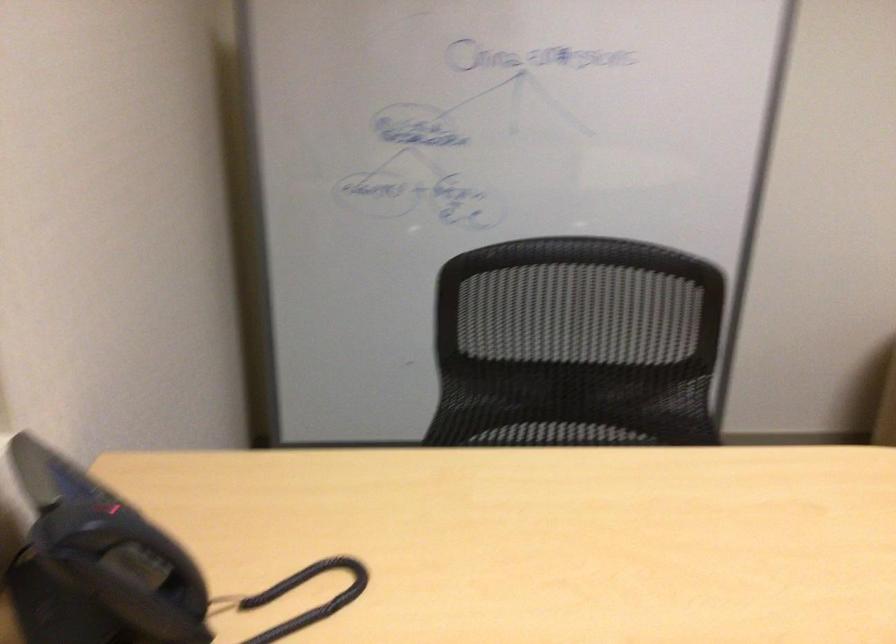
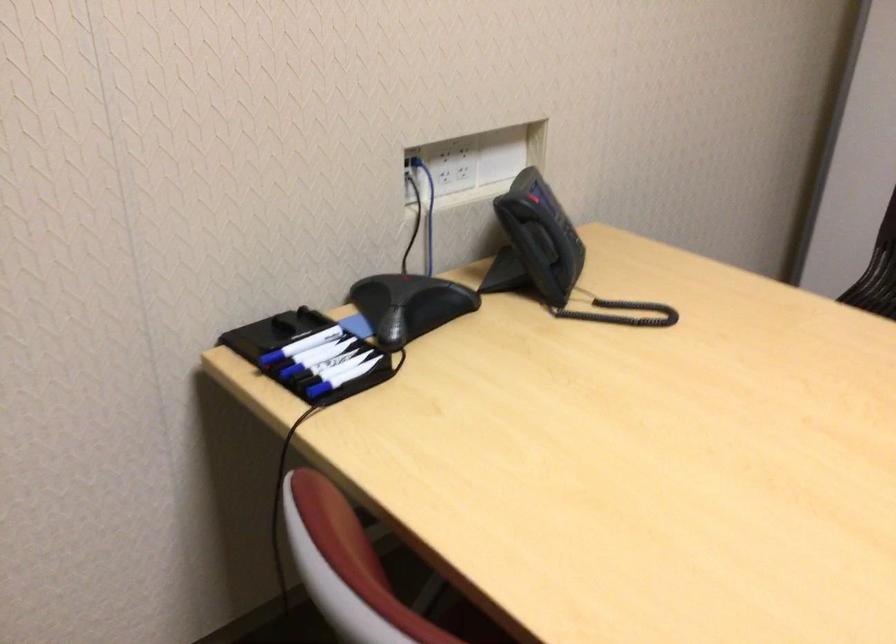
Find the pixel in the second image that matches point 158,526 in the first image.

(562, 225)